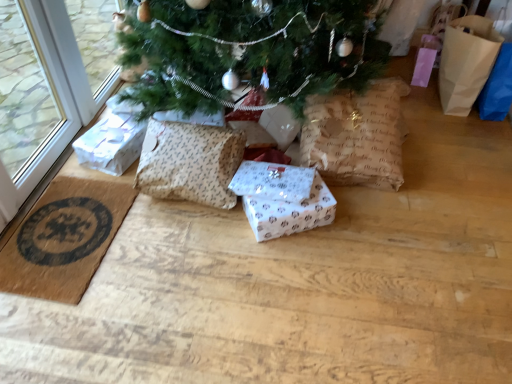
Question: Is brown paper bag at right thinner than white paper gift at left, arranged as the third gift box when viewed from the right?

Choices:
 (A) yes
 (B) no

Answer: (A)

Question: Is brown paper bag at right wider than white paper gift at left, arranged as the third gift box when viewed from the right?

Choices:
 (A) yes
 (B) no

Answer: (B)

Question: Considering the relative positions of brown paper bag at right and white paper gift at left, placed as the 1th gift box when sorted from left to right, in the image provided, is brown paper bag at right in front of white paper gift at left, placed as the 1th gift box when sorted from left to right,?

Choices:
 (A) no
 (B) yes

Answer: (A)

Question: Is brown paper bag at right shorter than white paper gift at left, arranged as the third gift box when viewed from the right?

Choices:
 (A) yes
 (B) no

Answer: (B)

Question: From the image's perspective, does brown paper bag at right appear lower than white paper gift at left, arranged as the third gift box when viewed from the right?

Choices:
 (A) no
 (B) yes

Answer: (A)

Question: Is white paper gift at left, arranged as the third gift box when viewed from the right, located within brown paper bag at right?

Choices:
 (A) no
 (B) yes

Answer: (A)

Question: Is patterned fabric pillow at center taller than brown paper bag at right?

Choices:
 (A) yes
 (B) no

Answer: (B)

Question: Is patterned fabric pillow at center looking in the opposite direction of brown paper bag at right?

Choices:
 (A) no
 (B) yes

Answer: (A)

Question: Can you see patterned fabric pillow at center touching brown paper bag at right?

Choices:
 (A) yes
 (B) no

Answer: (B)

Question: Considering the relative sizes of patterned fabric pillow at center and brown paper bag at right in the image provided, is patterned fabric pillow at center smaller than brown paper bag at right?

Choices:
 (A) yes
 (B) no

Answer: (A)

Question: Is patterned fabric pillow at center behind brown paper bag at right?

Choices:
 (A) no
 (B) yes

Answer: (A)

Question: Can you confirm if patterned fabric pillow at center is thinner than brown paper bag at right?

Choices:
 (A) no
 (B) yes

Answer: (B)

Question: From a real-world perspective, is white paper gift at center, which appears as the second gift box when viewed from the left, on white paper gift box at center, which is the 1th gift box from right to left?

Choices:
 (A) no
 (B) yes

Answer: (B)